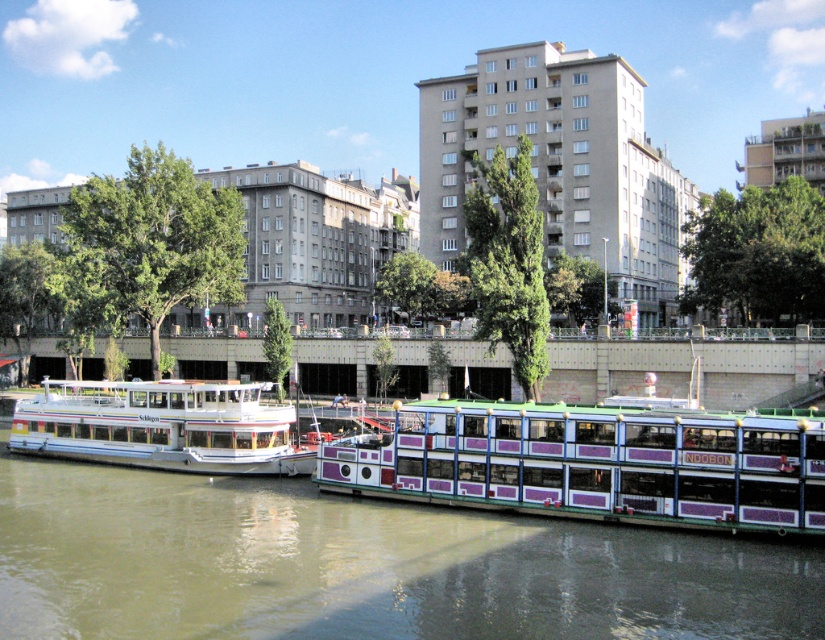
You are a tourist standing on the riverside and want to take a photo of both the purple painted glass boat at center and the white glossy boat at left. Which boat should you focus on first to ensure both are in the frame?

You should focus on the purple painted glass boat at center first because it is closer to you than the white glossy boat at left, so adjusting the camera to include both would require ensuring the closer boat is centered while framing the farther one in the background.